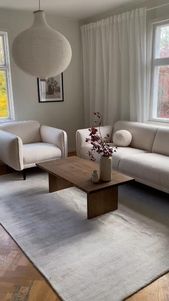
Where is `picture`? This screenshot has width=169, height=301. picture is located at coordinates (x=47, y=87).